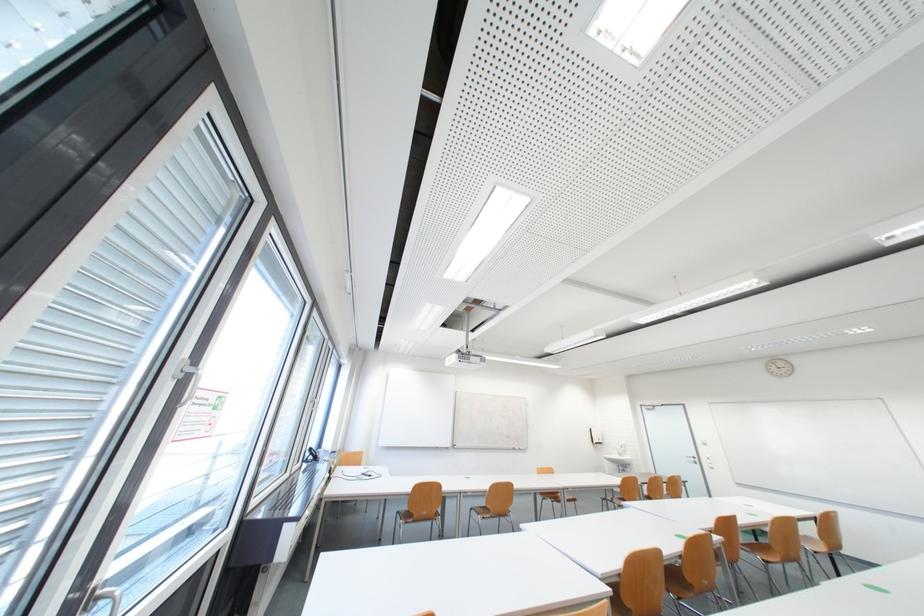
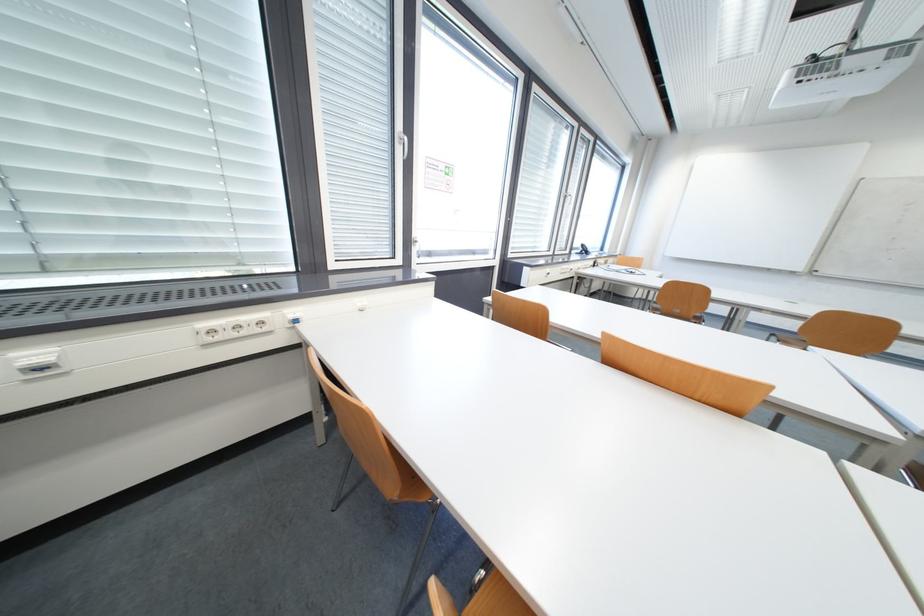
In the second image, find the point that corresponds to [315,451] in the first image.

(588, 246)